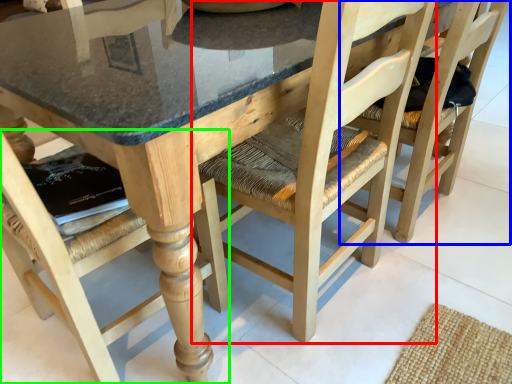
Question: Estimate the real-world distances between objects in this image. Which object is closer to chair (highlighted by a red box), chair (highlighted by a blue box) or chair (highlighted by a green box)?

Choices:
 (A) chair
 (B) chair

Answer: (A)